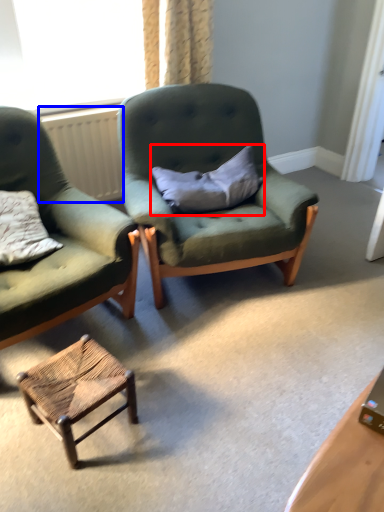
Question: Which point is further to the camera, pillow (highlighted by a red box) or radiator (highlighted by a blue box)?

Choices:
 (A) pillow
 (B) radiator

Answer: (B)